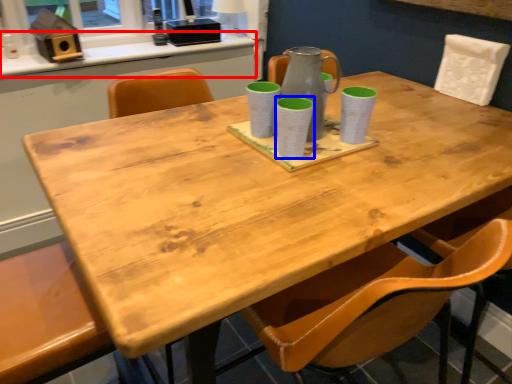
Question: Which object is further to the camera taking this photo, counter top (highlighted by a red box) or mug (highlighted by a blue box)?

Choices:
 (A) counter top
 (B) mug

Answer: (A)